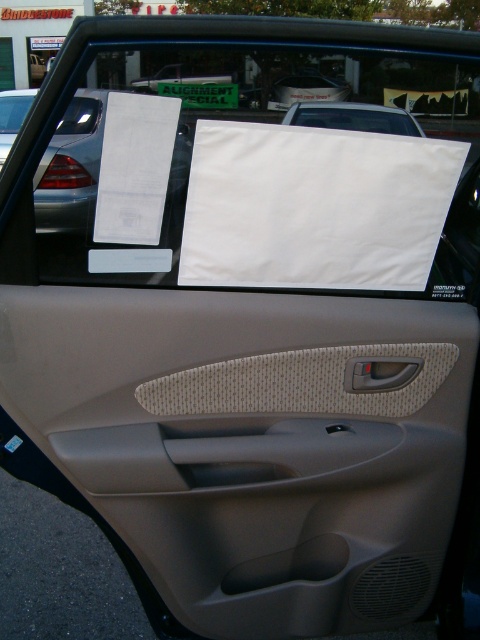
You are sitting in the passenger seat of a car and want to open the door. You see the beige textured door handle at center and the beige fabric door at center. Which object should you pull to open the door?

You should pull the beige textured door handle at center to open the door because it is the handle designed for opening the door, while the beige fabric door at center is part of the door panel itself.

You are inside a car and want to reach for two points on the passenger door panel. The first point is at coordinate point (380, 376) and the second is at point (11, 42). Which point is closer to you when you are sitting in the driver seat?

Point (380, 376) is closer to the viewer than point (11, 42).